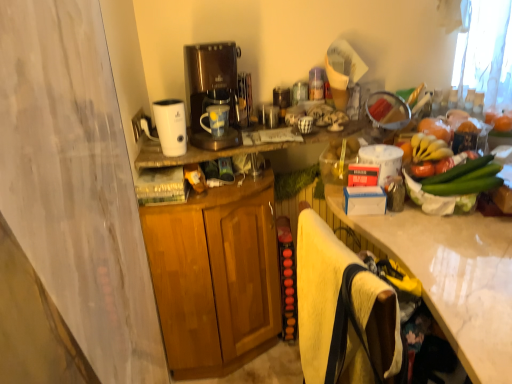
I want to click on free location in front of matte white mug at center, so click(214, 152).